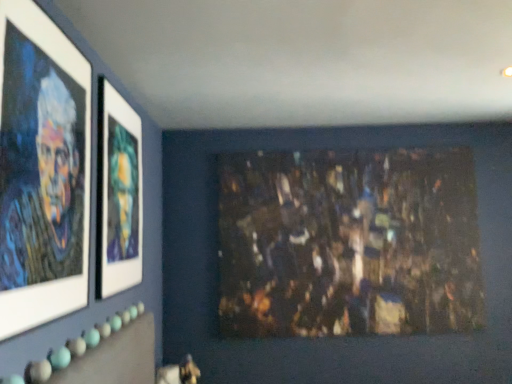
Question: In terms of width, does dark textured painting at center look wider or thinner when compared to matte black portrait at left, which is counted as the 2th picture frame, starting from the back?

Choices:
 (A) wide
 (B) thin

Answer: (A)

Question: In the image, is dark textured painting at center positioned in front of or behind matte black portrait at left, which is counted as the 2th picture frame, starting from the back?

Choices:
 (A) front
 (B) behind

Answer: (B)

Question: Which is farther from the dark textured painting at center?

Choices:
 (A) matte black portrait at left, arranged as the 1th picture frame when viewed from the front
 (B) matte glass picture frame at upper left, the first picture frame viewed from the back

Answer: (A)

Question: Based on their relative distances, which object is farther from the dark textured painting at center?

Choices:
 (A) matte black portrait at left, which is counted as the 2th picture frame, starting from the back
 (B) matte glass picture frame at upper left, the first picture frame viewed from the back

Answer: (A)